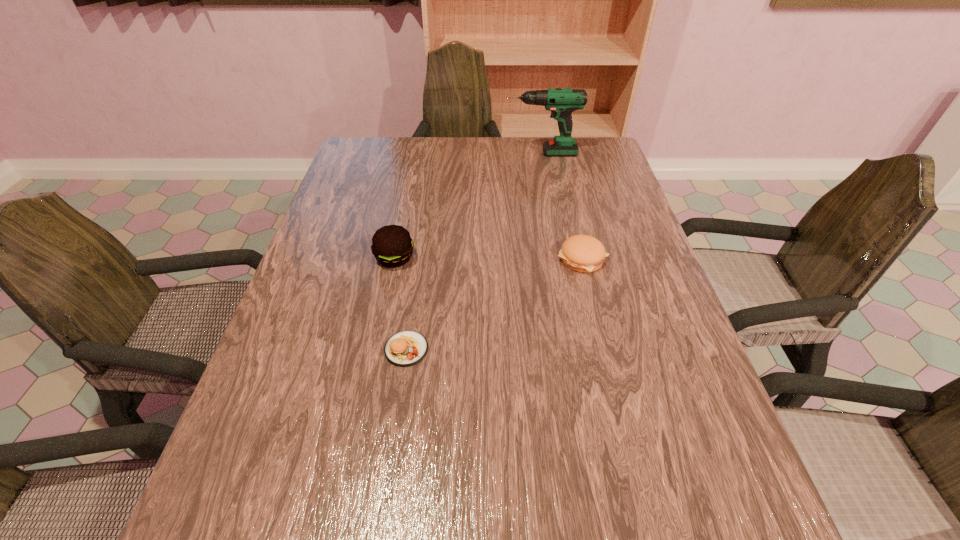
Find the location of a particular element. The height and width of the screenshot is (540, 960). vacant position located 0.050m on the back of the rightmost patty is located at coordinates (575, 230).

The width and height of the screenshot is (960, 540). Identify the location of free location located 0.280m on the back of the shortest patty. (421, 245).

Where is `object present at the far edge`? The width and height of the screenshot is (960, 540). object present at the far edge is located at coordinates (561, 102).

Find the location of a particular element. Image resolution: width=960 pixels, height=540 pixels. object located in the left edge section of the desktop is located at coordinates (392, 246).

Find the location of a particular element. The height and width of the screenshot is (540, 960). drill at the right edge is located at coordinates (561, 102).

I want to click on patty located at the right edge, so click(583, 253).

You are a GUI agent. You are given a task and a screenshot of the screen. Output one action in this format:
    pyautogui.click(x=<x>, y=<y>)
    Task: Click on the object located at the far right corner
    The height and width of the screenshot is (540, 960).
    Given the screenshot: What is the action you would take?
    [x=561, y=102]

This screenshot has height=540, width=960. I want to click on free region at the far edge of the desktop, so click(x=479, y=175).

The height and width of the screenshot is (540, 960). In the image, there is a desktop. What are the coordinates of `vacant space at the near edge` in the screenshot? It's located at (631, 523).

Locate an element on the screen. The height and width of the screenshot is (540, 960). vacant region at the left edge of the desktop is located at coordinates (318, 227).